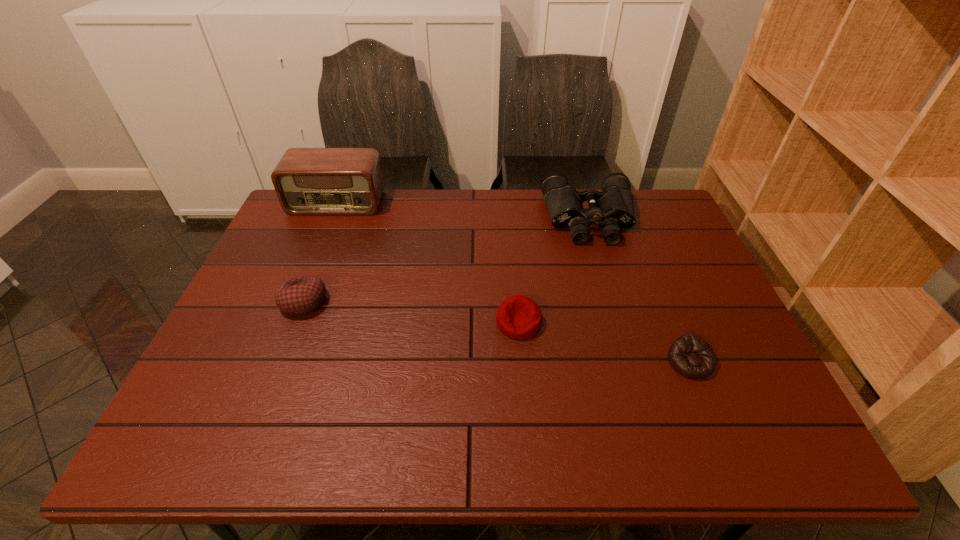
You are a GUI agent. You are given a task and a screenshot of the screen. Output one action in this format:
    pyautogui.click(x=<x>, y=<y>)
    Task: Click on the empty space between the nearest object and the radio receiver
    The image size is (960, 540).
    Given the screenshot: What is the action you would take?
    pyautogui.click(x=514, y=282)

The image size is (960, 540). Find the location of `vacant space in between the fourth shortest object and the tallest object`. vacant space in between the fourth shortest object and the tallest object is located at coordinates (463, 211).

This screenshot has height=540, width=960. Find the location of `free spot between the tallest object and the shortest object`. free spot between the tallest object and the shortest object is located at coordinates (514, 282).

You are a GUI agent. You are given a task and a screenshot of the screen. Output one action in this format:
    pyautogui.click(x=<x>, y=<y>)
    Task: Click on the free area in between the binoculars and the shortest object
    
    Given the screenshot: What is the action you would take?
    pyautogui.click(x=639, y=291)

Point out which object is positioned as the fourth nearest to the tallest object. Please provide its 2D coordinates. Your answer should be formatted as a tuple, i.e. [(x, y)], where the tuple contains the x and y coordinates of a point satisfying the conditions above.

[(689, 355)]

Locate which object ranks third in proximity to the radio receiver. Please provide its 2D coordinates. Your answer should be formatted as a tuple, i.e. [(x, y)], where the tuple contains the x and y coordinates of a point satisfying the conditions above.

[(519, 317)]

You are a GUI agent. You are given a task and a screenshot of the screen. Output one action in this format:
    pyautogui.click(x=<x>, y=<y>)
    Task: Click on the beanbag that is the closest to the shortest object
    This screenshot has width=960, height=540.
    Given the screenshot: What is the action you would take?
    pyautogui.click(x=519, y=317)

Locate an element on the screen. The image size is (960, 540). beanbag that is the third nearest to the binoculars is located at coordinates (300, 295).

The height and width of the screenshot is (540, 960). Find the location of `vacant area in the image that satisfies the following two spatial constraints: 1. on the front panel of the radio receiver; 2. on the left side of the shortest beanbag`. vacant area in the image that satisfies the following two spatial constraints: 1. on the front panel of the radio receiver; 2. on the left side of the shortest beanbag is located at coordinates (272, 362).

You are a GUI agent. You are given a task and a screenshot of the screen. Output one action in this format:
    pyautogui.click(x=<x>, y=<y>)
    Task: Click on the vacant space that satisfies the following two spatial constraints: 1. through the eyepieces of the nearest beanbag; 2. on the left side of the binoculars
    
    Given the screenshot: What is the action you would take?
    pyautogui.click(x=631, y=362)